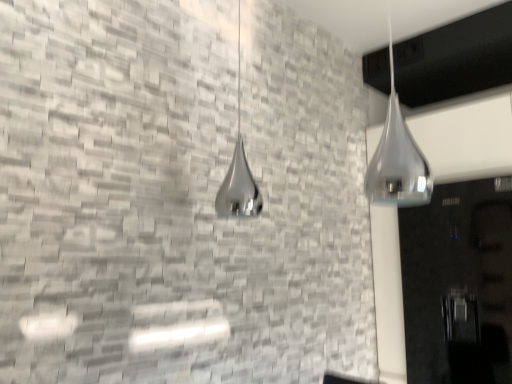
Question: From the image's perspective, is polished chrome shower at upper right, placed as the second shower when sorted from back to front, above or below polished chrome shower at center, marked as the 2th shower in a right-to-left arrangement?

Choices:
 (A) below
 (B) above

Answer: (A)

Question: Is point (395, 100) closer or farther from the camera than point (233, 185)?

Choices:
 (A) farther
 (B) closer

Answer: (A)

Question: Estimate the real-world distances between objects in this image. Which object is farther from the polished chrome shower at upper right, which is the first shower in front-to-back order?

Choices:
 (A) polished chrome shower at center, marked as the 2th shower in a right-to-left arrangement
 (B) glossy black door at right

Answer: (A)

Question: Estimate the real-world distances between objects in this image. Which object is farther from the glossy black door at right?

Choices:
 (A) polished chrome shower at upper right, which is the first shower in front-to-back order
 (B) polished chrome shower at center, acting as the 2th shower starting from the front

Answer: (B)